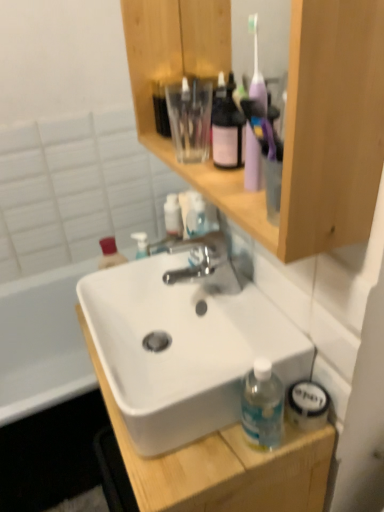
You are a GUI agent. You are given a task and a screenshot of the screen. Output one action in this format:
    pyautogui.click(x=<x>, y=<y>)
    Task: Click on the vacant area that is in front of polished chrome faucet at center
    
    Given the screenshot: What is the action you would take?
    pyautogui.click(x=242, y=331)